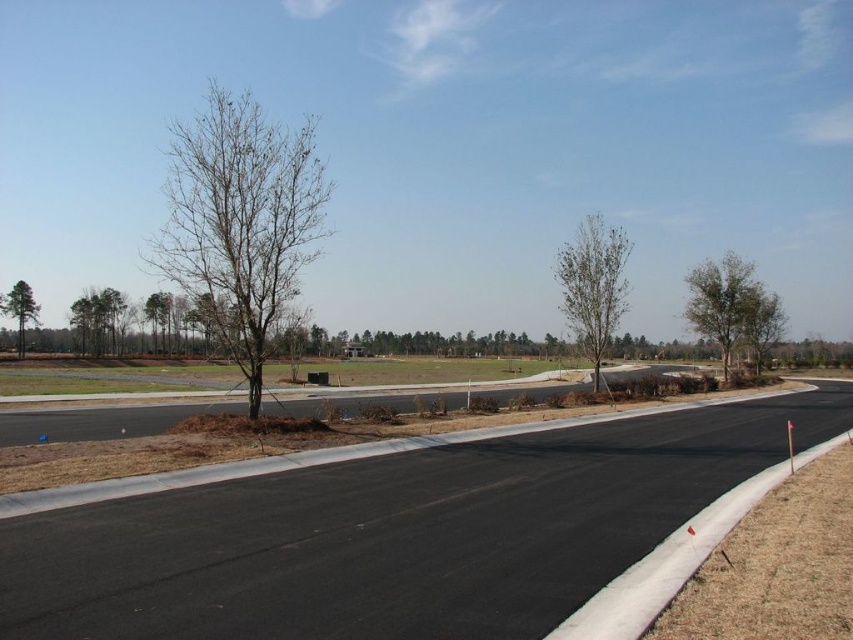
Is bare wood tree at left wider than green matte tree at left?

Indeed, bare wood tree at left has a greater width compared to green matte tree at left.

Does point (91, 355) come in front of point (21, 344)?

No, it is not.

Locate an element on the screen. The width and height of the screenshot is (853, 640). bare wood tree at left is located at coordinates (96, 321).

Does bare wood tree at center lie behind green leafy tree at right?

No, it is in front of green leafy tree at right.

Is bare wood tree at center thinner than green leafy tree at right?

Yes.

In order to click on bare wood tree at center in this screenshot , I will do `click(593, 285)`.

You are a GUI agent. You are given a task and a screenshot of the screen. Output one action in this format:
    pyautogui.click(x=<x>, y=<y>)
    Task: Click on the bare wood tree at center
    The height and width of the screenshot is (640, 853).
    Given the screenshot: What is the action you would take?
    pyautogui.click(x=593, y=285)

Can you confirm if bare branches at left is wider than bare wood tree at left?

Indeed, bare branches at left has a greater width compared to bare wood tree at left.

Can you confirm if bare branches at left is shorter than bare wood tree at left?

Incorrect, bare branches at left's height does not fall short of bare wood tree at left's.

Image resolution: width=853 pixels, height=640 pixels. Describe the element at coordinates (241, 221) in the screenshot. I see `bare branches at left` at that location.

The height and width of the screenshot is (640, 853). Identify the location of bare branches at left. (241, 221).